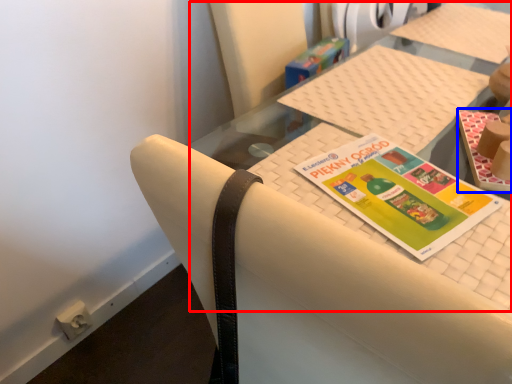
Question: Which object is further to the camera taking this photo, tablecloth (highlighted by a red box) or book (highlighted by a blue box)?

Choices:
 (A) tablecloth
 (B) book

Answer: (B)